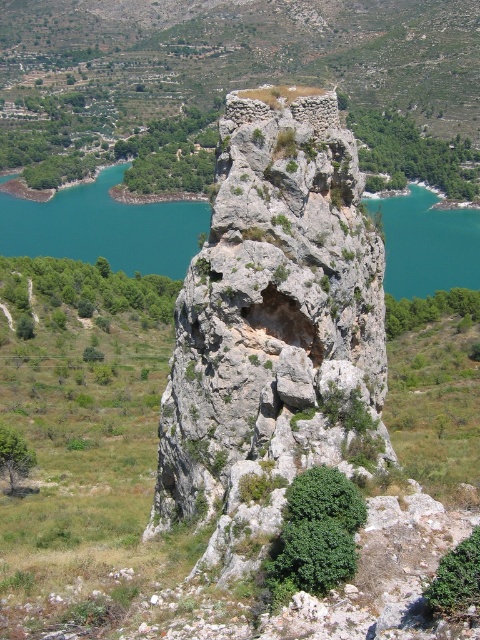
Is point (211, 428) farther from camera compared to point (374, 170)?

No, it is not.

Between point (248, 547) and point (381, 118), which one is positioned in front?

Point (248, 547) is in front.

Between point (190, 496) and point (420, 160), which one is positioned behind?

Point (420, 160)

In order to click on gray rough rock at center in this screenshot , I will do `click(272, 324)`.

Does point (455, 157) come farther from viewer compared to point (460, 312)?

Yes, point (455, 157) is farther from viewer.

Looking at this image, how much distance is there between green leafy shrubs at upper right and green leafy shrubs at center right?

green leafy shrubs at upper right is 150.98 meters away from green leafy shrubs at center right.

Is point (388, 144) farther from camera compared to point (475, 307)?

Yes, it is behind point (475, 307).

In order to click on green leafy shrubs at upper right in this screenshot , I will do `click(412, 154)`.

Which is below, green leafy bush at center or green leafy shrubs at lower left?

green leafy bush at center

Who is taller, green leafy bush at center or green leafy shrubs at lower left?

With more height is green leafy shrubs at lower left.

Is point (311, 570) less distant than point (113, 312)?

Yes, it is.

Locate an element on the screen. The image size is (480, 640). green leafy bush at center is located at coordinates (316, 532).